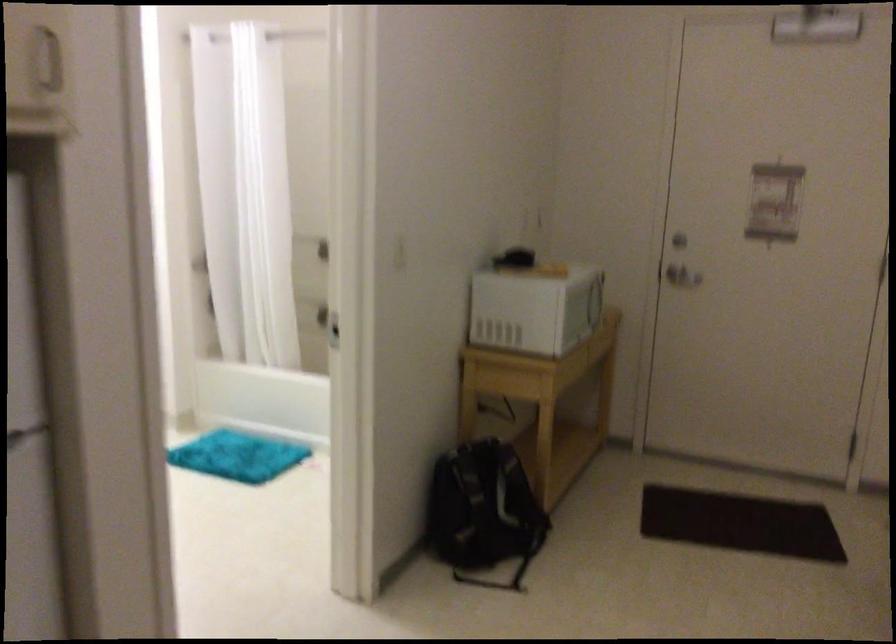
Where is `white microwave dial`? This screenshot has width=896, height=644. white microwave dial is located at coordinates (596, 301).